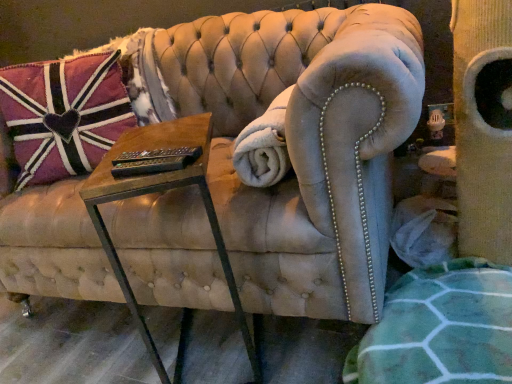
Identify the location of free space above woodenmaterial/texturetable at center (from a real-world perspective). (155, 140).